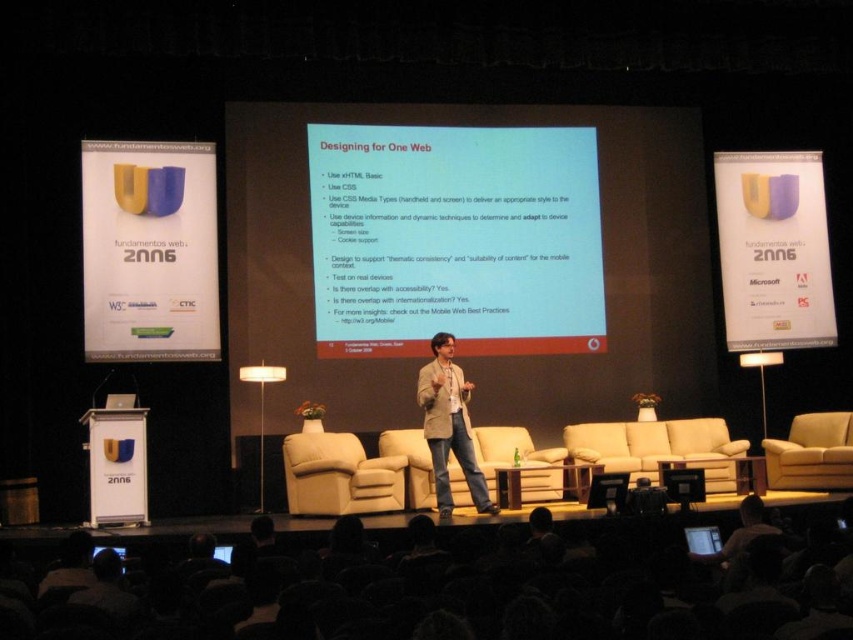
You are an event organizer who needs to place a new decorative item on the stage. The item is larger than the purple paper at upper center but smaller than the light beige leather couch at center. Where on the stage would be a suitable location for this item?

The new decorative item should be placed between the light beige leather couch at center and the purple paper at upper center since it is larger than the purple paper at upper center but smaller than the light beige leather couch at center.

From the picture: You are an attendee at the conference and need to sit down. There are two chairs available on stage. Which chair is closer to the center of the stage? The light beige leather armchair at center or the beige fabric armchair at right?

The light beige leather armchair at center is closer to the center of the stage because it is positioned over the beige fabric armchair at right, indicating it is centrally located.